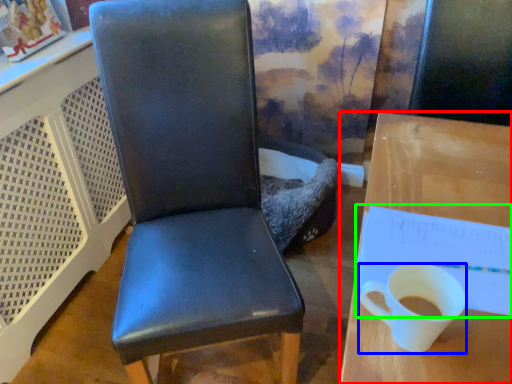
Question: Based on their relative distances, which object is farther from desk (highlighted by a red box)? Choose from coffee cup (highlighted by a blue box) and notepad (highlighted by a green box).

Choices:
 (A) coffee cup
 (B) notepad

Answer: (A)